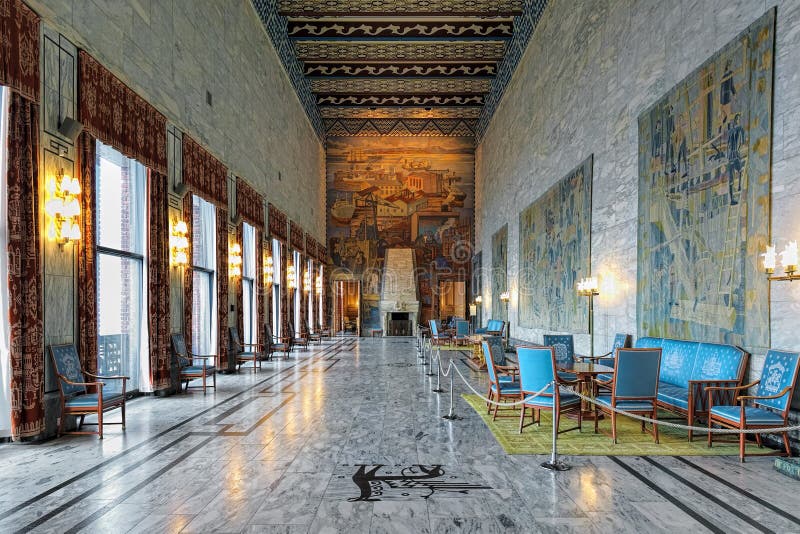
The image size is (800, 534). I want to click on brass wall sconce with white globe, so click(785, 259).